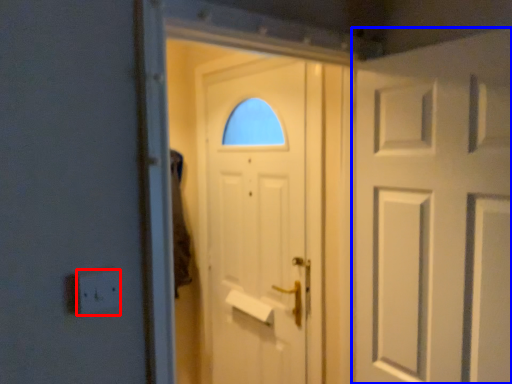
Question: Which object appears closest to the camera in this image, electric outlet (highlighted by a red box) or door (highlighted by a blue box)?

Choices:
 (A) electric outlet
 (B) door

Answer: (A)